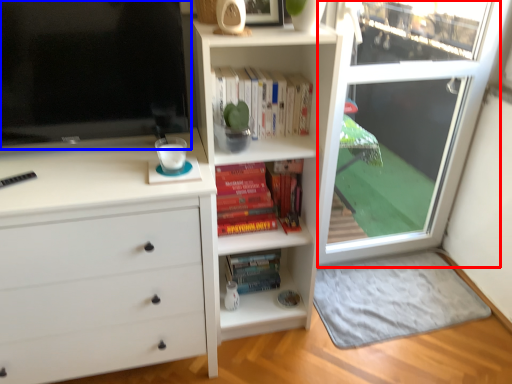
Question: Which of the following is the closest to the observer, screen door (highlighted by a red box) or television (highlighted by a blue box)?

Choices:
 (A) screen door
 (B) television

Answer: (B)